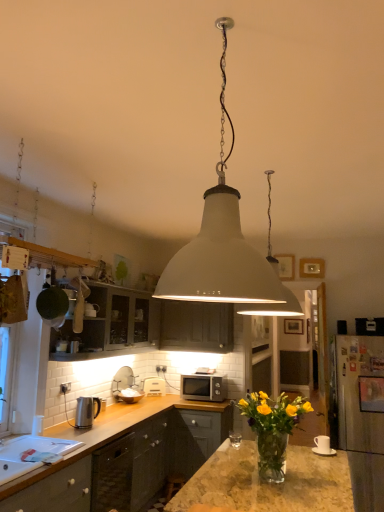
Question: From a real-world perspective, is matte dark wood cabinets at upper left, which appears as the first cabinetry when viewed from the left, physically above white plastic electric outlet at center?

Choices:
 (A) no
 (B) yes

Answer: (B)

Question: From the image's perspective, is matte dark wood cabinets at upper left, which is counted as the second cabinetry, starting from the right, beneath white plastic electric outlet at center?

Choices:
 (A) no
 (B) yes

Answer: (A)

Question: Considering the relative sizes of matte dark wood cabinets at upper left, which is counted as the second cabinetry, starting from the right, and white plastic electric outlet at center in the image provided, is matte dark wood cabinets at upper left, which is counted as the second cabinetry, starting from the right, wider than white plastic electric outlet at center?

Choices:
 (A) yes
 (B) no

Answer: (A)

Question: Is matte dark wood cabinets at upper left, which appears as the first cabinetry when viewed from the left, behind white plastic electric outlet at center?

Choices:
 (A) yes
 (B) no

Answer: (B)

Question: Does matte dark wood cabinets at upper left, which appears as the first cabinetry when viewed from the left, appear on the left side of white plastic electric outlet at center?

Choices:
 (A) yes
 (B) no

Answer: (A)

Question: Relative to polished stainless steel kettle at lower left, arranged as the second appliance when viewed from the right, is white matte microwave at center, which is counted as the second appliance, starting from the front, in front or behind?

Choices:
 (A) front
 (B) behind

Answer: (B)

Question: Does point (148, 379) appear closer or farther from the camera than point (84, 425)?

Choices:
 (A) farther
 (B) closer

Answer: (A)

Question: From a real-world perspective, is white matte microwave at center, the first appliance in the right-to-left sequence, positioned above or below polished stainless steel kettle at lower left, which is counted as the 1th appliance, starting from the top?

Choices:
 (A) above
 (B) below

Answer: (B)

Question: Is white matte microwave at center, the second appliance from the left, to the left or to the right of polished stainless steel kettle at lower left, the 2th appliance positioned from the back, in the image?

Choices:
 (A) right
 (B) left

Answer: (A)

Question: Looking at their shapes, would you say translucent glass vase at center is wider or thinner than white matte pendant light at center, which is counted as the 1th lamp, starting from the front?

Choices:
 (A) wide
 (B) thin

Answer: (A)

Question: Which is correct: translucent glass vase at center is inside white matte pendant light at center, the 2th lamp viewed from the back, or outside of it?

Choices:
 (A) outside
 (B) inside

Answer: (A)

Question: Looking at the image, does translucent glass vase at center seem bigger or smaller compared to white matte pendant light at center, which is counted as the 1th lamp, starting from the front?

Choices:
 (A) big
 (B) small

Answer: (B)

Question: From a real-world perspective, relative to white matte pendant light at center, which is counted as the 1th lamp, starting from the front, is translucent glass vase at center vertically above or below?

Choices:
 (A) above
 (B) below

Answer: (B)

Question: From a real-world perspective, is white matte pendant light at center, which is counted as the 1th lamp, starting from the front, positioned above or below satin silver microwave at center?

Choices:
 (A) below
 (B) above

Answer: (B)

Question: Considering the positions of white matte pendant light at center, positioned as the second lamp in right-to-left order, and satin silver microwave at center in the image, is white matte pendant light at center, positioned as the second lamp in right-to-left order, wider or thinner than satin silver microwave at center?

Choices:
 (A) wide
 (B) thin

Answer: (A)